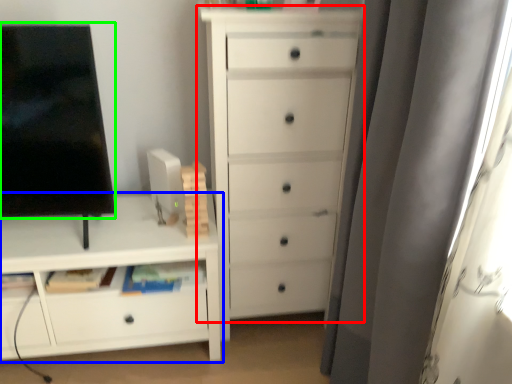
Question: Considering the real-world distances, which object is farthest from chest of drawers (highlighted by a red box)? chest of drawers (highlighted by a blue box) or screen (highlighted by a green box)?

Choices:
 (A) chest of drawers
 (B) screen

Answer: (B)